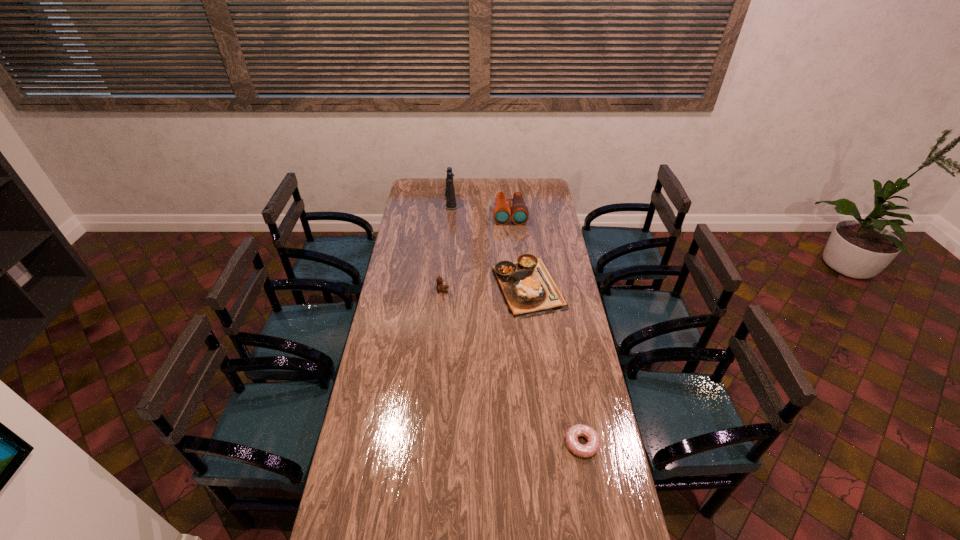
Identify the location of vacant space in between the second shortest object and the tallest object. This screenshot has height=540, width=960. (489, 245).

Locate an element on the screen. free area in between the teddy bear and the second tallest object is located at coordinates (476, 252).

The height and width of the screenshot is (540, 960). Find the location of `free space between the taller binoculars and the third tallest object`. free space between the taller binoculars and the third tallest object is located at coordinates (446, 246).

You are a GUI agent. You are given a task and a screenshot of the screen. Output one action in this format:
    pyautogui.click(x=<x>, y=<y>)
    Task: Click on the free spot between the teddy bear and the doughnut
    The width and height of the screenshot is (960, 540).
    Given the screenshot: What is the action you would take?
    pyautogui.click(x=513, y=367)

Identify the location of unoccupied area between the shorter binoculars and the platter. The image size is (960, 540). (518, 251).

You are a GUI agent. You are given a task and a screenshot of the screen. Output one action in this format:
    pyautogui.click(x=<x>, y=<y>)
    Task: Click on the free area in between the left binoculars and the teddy bear
    This screenshot has height=540, width=960.
    Given the screenshot: What is the action you would take?
    pyautogui.click(x=446, y=246)

Where is `object that is the second closest to the shorter binoculars`? The height and width of the screenshot is (540, 960). object that is the second closest to the shorter binoculars is located at coordinates (528, 289).

Find the location of a particular element. Image resolution: width=960 pixels, height=540 pixels. the third closest object to the teddy bear is located at coordinates (450, 190).

Choose which binoculars is the nearest neighbor to the fourth tallest object. Please provide its 2D coordinates. Your answer should be formatted as a tuple, i.e. [(x, y)], where the tuple contains the x and y coordinates of a point satisfying the conditions above.

[(502, 213)]

Find the location of a particular element. Image resolution: width=960 pixels, height=540 pixels. vacant space that satisfies the following two spatial constraints: 1. at the face of the third tallest object; 2. on the left side of the shortest object is located at coordinates (429, 444).